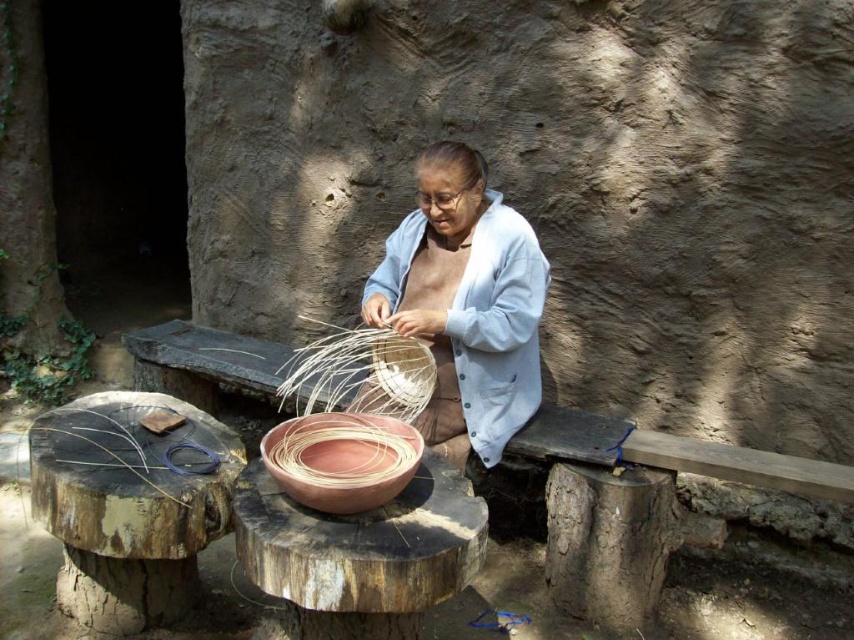
Is light blue fabric at center to the left of terracotta woven basket at center from the viewer's perspective?

No, light blue fabric at center is not to the left of terracotta woven basket at center.

What do you see at coordinates (498, 326) in the screenshot? I see `light blue fabric at center` at bounding box center [498, 326].

What do you see at coordinates (498, 326) in the screenshot?
I see `light blue fabric at center` at bounding box center [498, 326].

The height and width of the screenshot is (640, 854). I want to click on light blue fabric at center, so click(x=498, y=326).